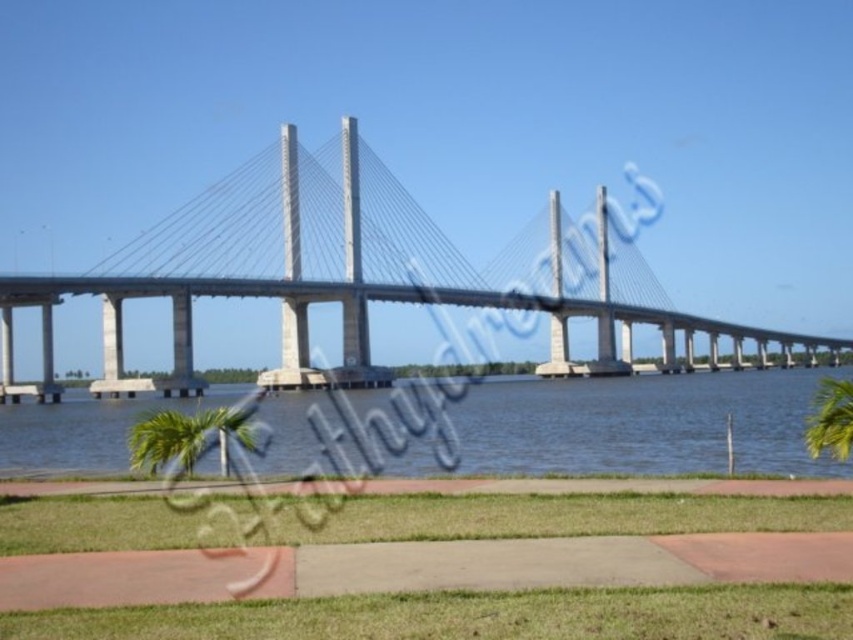
Question: Considering the real-world distances, which object is farthest from the green leafy palm tree at lower left?

Choices:
 (A) green leafy palm tree at lower right
 (B) concrete bridge at center
 (C) clear water at lower center

Answer: (B)

Question: Can you confirm if concrete bridge at center is positioned above green leafy palm tree at lower left?

Choices:
 (A) yes
 (B) no

Answer: (A)

Question: Which object is closer to the camera taking this photo?

Choices:
 (A) clear water at lower center
 (B) green leafy palm tree at lower left
 (C) green leafy palm tree at lower right
 (D) concrete bridge at center

Answer: (C)

Question: In this image, where is concrete bridge at center located relative to green leafy palm tree at lower left?

Choices:
 (A) above
 (B) below

Answer: (A)

Question: Is concrete bridge at center positioned at the back of green leafy palm tree at lower left?

Choices:
 (A) yes
 (B) no

Answer: (A)

Question: Among these points, which one is farthest from the camera?

Choices:
 (A) (850, 426)
 (B) (572, 252)
 (C) (199, 417)

Answer: (B)